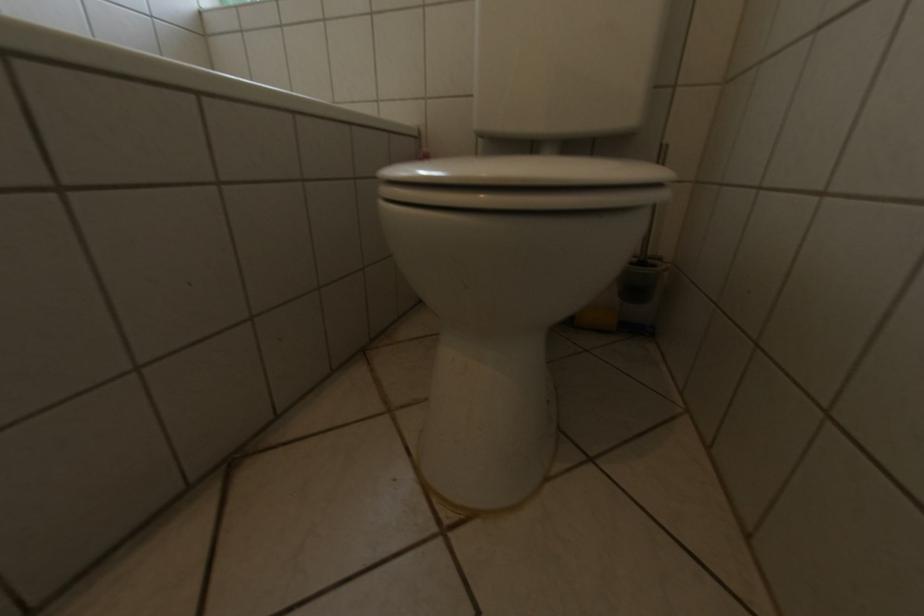
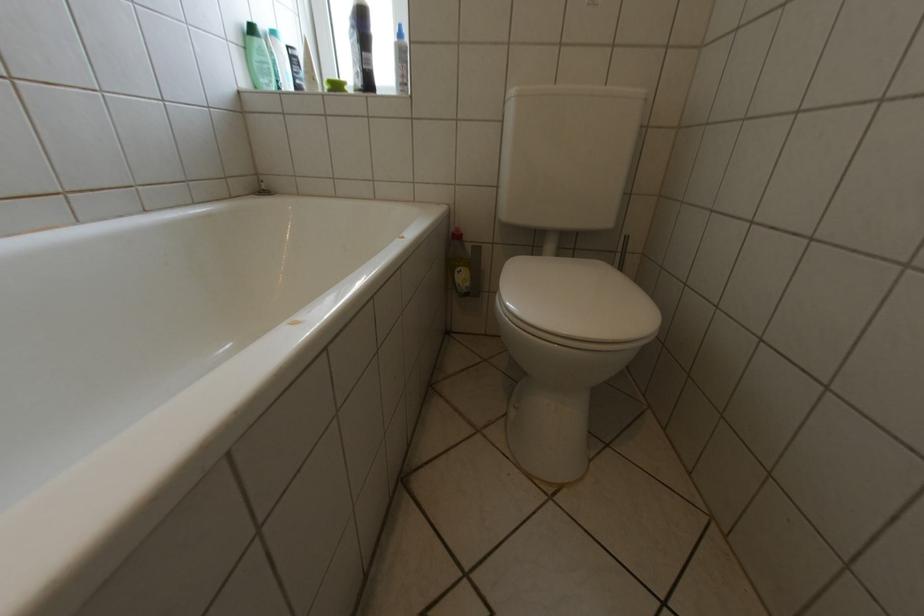
Question: The images are taken continuously from a first-person perspective. In which direction is your viewpoint rotating?

Choices:
 (A) Left
 (B) Right
 (C) Up
 (D) Down

Answer: (B)